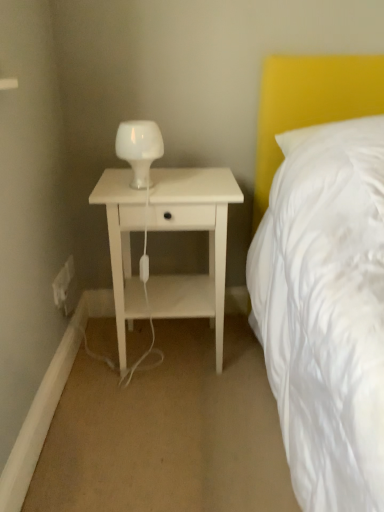
Question: Is white matte nightstand at center thinner than white plastic electric outlet at lower left, arranged as the 2th electric outlet when viewed from the front?

Choices:
 (A) yes
 (B) no

Answer: (B)

Question: Is white matte nightstand at center oriented away from white plastic electric outlet at lower left, arranged as the 2th electric outlet when viewed from the front?

Choices:
 (A) yes
 (B) no

Answer: (B)

Question: From a real-world perspective, is white matte nightstand at center over white plastic electric outlet at lower left, the first electric outlet viewed from the back?

Choices:
 (A) yes
 (B) no

Answer: (A)

Question: From the image's perspective, would you say white matte nightstand at center is shown under white plastic electric outlet at lower left, arranged as the 2th electric outlet when viewed from the front?

Choices:
 (A) no
 (B) yes

Answer: (B)

Question: Is white matte nightstand at center outside white plastic electric outlet at lower left, arranged as the 2th electric outlet when viewed from the front?

Choices:
 (A) no
 (B) yes

Answer: (B)

Question: From a real-world perspective, relative to white plastic electric outlet at lower left, arranged as the second electric outlet when viewed from the back, is white plastic electric outlet at lower left, arranged as the 2th electric outlet when viewed from the front, vertically above or below?

Choices:
 (A) below
 (B) above

Answer: (B)

Question: In terms of height, does white plastic electric outlet at lower left, the first electric outlet viewed from the back, look taller or shorter compared to white plastic electric outlet at lower left, arranged as the second electric outlet when viewed from the back?

Choices:
 (A) tall
 (B) short

Answer: (B)

Question: Choose the correct answer: Is white plastic electric outlet at lower left, the first electric outlet viewed from the back, inside white plastic electric outlet at lower left, which appears as the first electric outlet when viewed from the front, or outside it?

Choices:
 (A) outside
 (B) inside

Answer: (A)

Question: Is white plastic electric outlet at lower left, arranged as the 2th electric outlet when viewed from the front, wider or thinner than white plastic electric outlet at lower left, arranged as the second electric outlet when viewed from the back?

Choices:
 (A) wide
 (B) thin

Answer: (A)

Question: From the image's perspective, is white plastic electric outlet at lower left, arranged as the second electric outlet when viewed from the back, above or below white matte nightstand at center?

Choices:
 (A) above
 (B) below

Answer: (B)

Question: Considering the positions of white plastic electric outlet at lower left, which appears as the first electric outlet when viewed from the front, and white matte nightstand at center in the image, is white plastic electric outlet at lower left, which appears as the first electric outlet when viewed from the front, taller or shorter than white matte nightstand at center?

Choices:
 (A) short
 (B) tall

Answer: (A)

Question: Is white plastic electric outlet at lower left, which appears as the first electric outlet when viewed from the front, to the left or to the right of white matte nightstand at center in the image?

Choices:
 (A) left
 (B) right

Answer: (A)

Question: Looking at their shapes, would you say white plastic electric outlet at lower left, which appears as the first electric outlet when viewed from the front, is wider or thinner than white matte nightstand at center?

Choices:
 (A) wide
 (B) thin

Answer: (B)

Question: Looking at the image, does white glass lamp at center seem bigger or smaller compared to white matte nightstand at center?

Choices:
 (A) small
 (B) big

Answer: (A)

Question: From a real-world perspective, relative to white matte nightstand at center, is white glass lamp at center vertically above or below?

Choices:
 (A) above
 (B) below

Answer: (A)